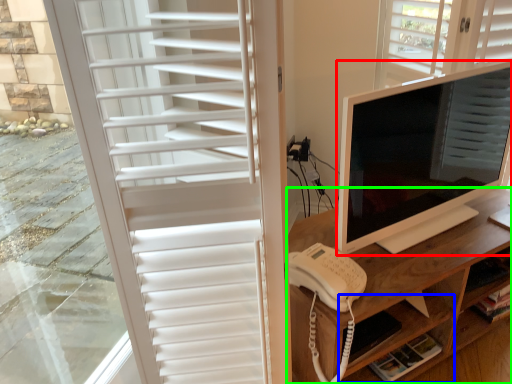
Question: Considering the real-world distances, which object is closest to computer monitor (highlighted by a red box)? shelf (highlighted by a blue box) or desk (highlighted by a green box).

Choices:
 (A) shelf
 (B) desk

Answer: (B)